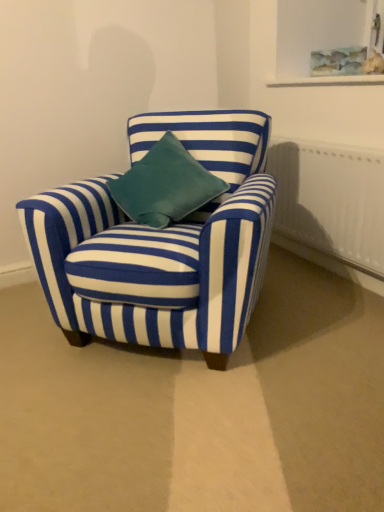
Question: From a real-world perspective, is blue striped fabric chair at center physically located above or below white textured radiator at right?

Choices:
 (A) below
 (B) above

Answer: (B)

Question: Does point (69, 239) appear closer or farther from the camera than point (329, 219)?

Choices:
 (A) closer
 (B) farther

Answer: (A)

Question: From the image's perspective, is blue striped fabric chair at center located above or below white textured radiator at right?

Choices:
 (A) below
 (B) above

Answer: (A)

Question: Based on their sizes in the image, would you say white textured radiator at right is bigger or smaller than blue striped fabric chair at center?

Choices:
 (A) small
 (B) big

Answer: (A)

Question: Does point (278, 159) appear closer or farther from the camera than point (132, 280)?

Choices:
 (A) farther
 (B) closer

Answer: (A)

Question: From the image's perspective, is white textured radiator at right located above or below blue striped fabric chair at center?

Choices:
 (A) below
 (B) above

Answer: (B)

Question: Relative to blue striped fabric chair at center, is white textured radiator at right in front or behind?

Choices:
 (A) front
 (B) behind

Answer: (B)